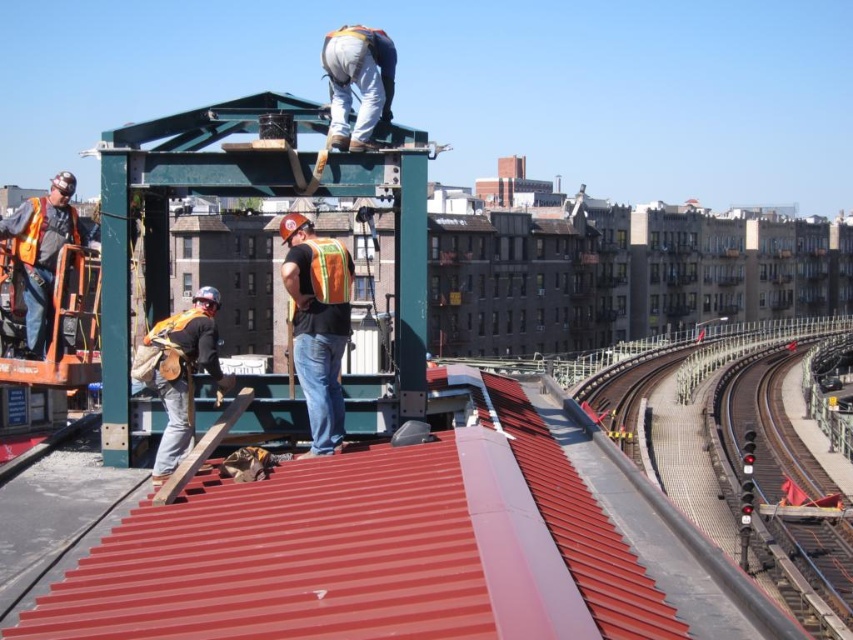
You are a safety inspector reviewing the construction site image. You notice two orange safety vests. Which one, the orange safety vest at center or the orange reflective safety vest at left, is bigger in size?

The orange safety vest at center is larger in size than the orange reflective safety vest at left.

You are a safety inspector checking the construction site. You notice the orange safety vest at center and the smooth metal track at right. Which object is closer to the ground?

The orange safety vest at center is shorter than the smooth metal track at right, so it is closer to the ground.

You are a safety inspector analyzing the construction site. You need to determine the exact location of the orange safety vest at center. What are its coordinates?

The orange safety vest at center is located at coordinates point (178, 371).